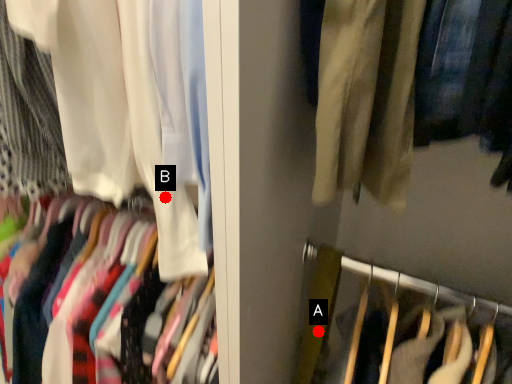
Question: Two points are circled on the image, labeled by A and B beside each circle. Which point is closer to the camera?

Choices:
 (A) A is closer
 (B) B is closer

Answer: (B)